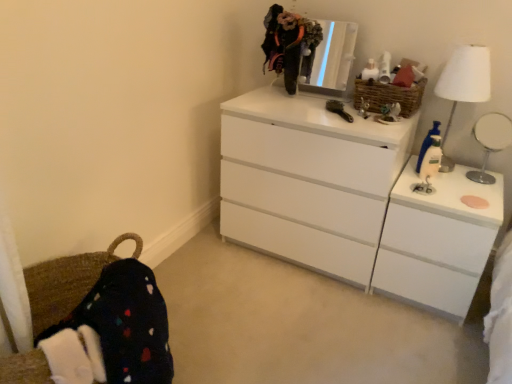
In order to click on free space to the left of woven brown basket at upper right in this screenshot , I will do `click(334, 106)`.